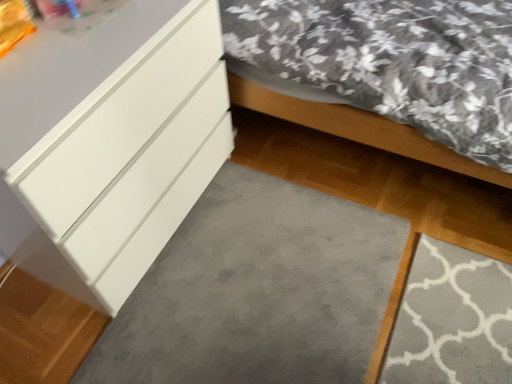
Image resolution: width=512 pixels, height=384 pixels. What are the coordinates of `vacant point above white glossy chest of drawers at left (from a real-world perspective)` in the screenshot? It's located at (67, 47).